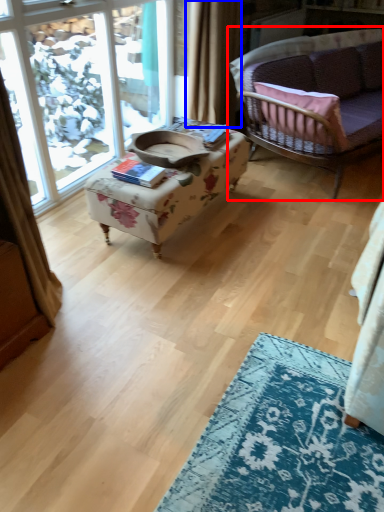
Question: Among these objects, which one is nearest to the camera, studio couch (highlighted by a red box) or curtain (highlighted by a blue box)?

Choices:
 (A) studio couch
 (B) curtain

Answer: (A)